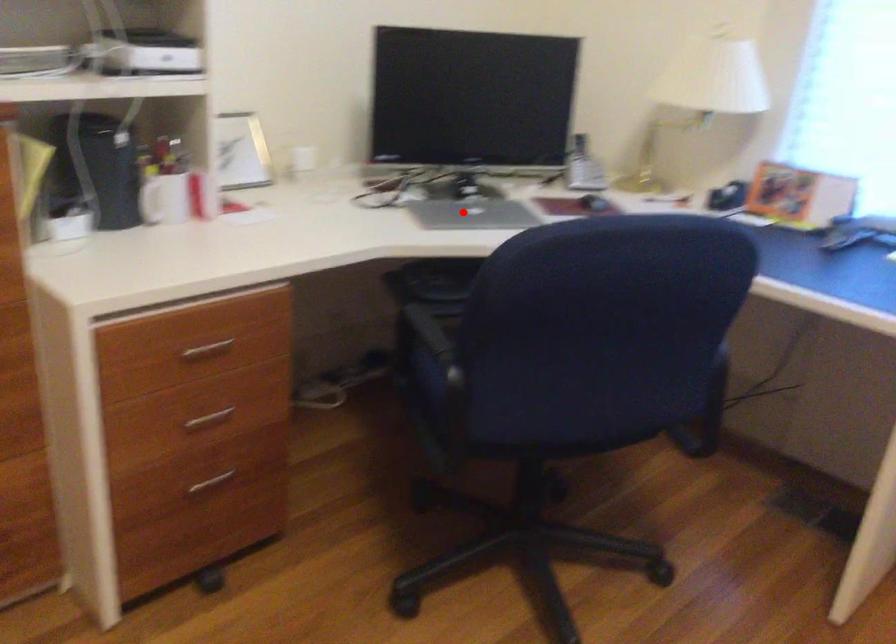
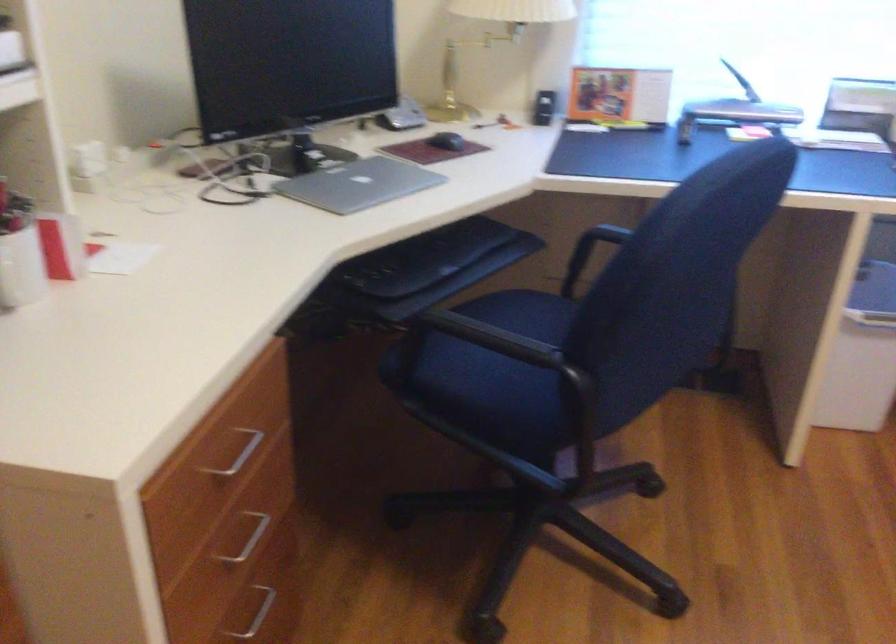
The point at the highlighted location is marked in the first image. Where is the corresponding point in the second image?

(358, 184)